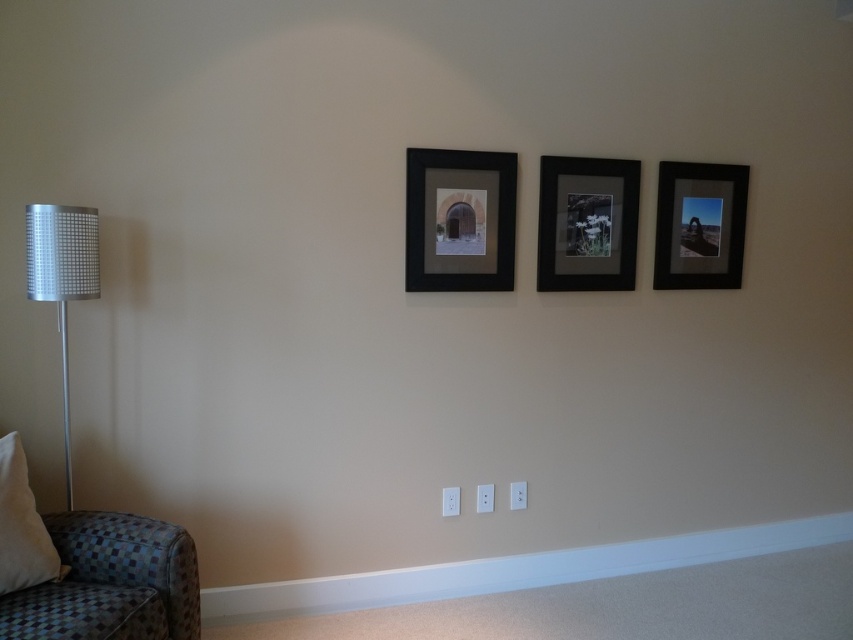
From the picture: You are standing in the room and want to hang a new picture between the two points, point [125,566] and point [407,221]. Which point should the new picture be closer to if you want it to be closer to the wall?

The new picture should be closer to point [125,566] because it is in front of point [407,221], meaning it is closer to the viewer and thus the wall would be behind it.

You are hanging a new picture frame and want to know the vertical arrangement of the existing frames. Which frame is placed lower on the wall between the black matte picture frame at center and the matte black picture frame at center?

The black matte picture frame at center is positioned under the matte black picture frame at center, so the black matte picture frame at center is lower on the wall.